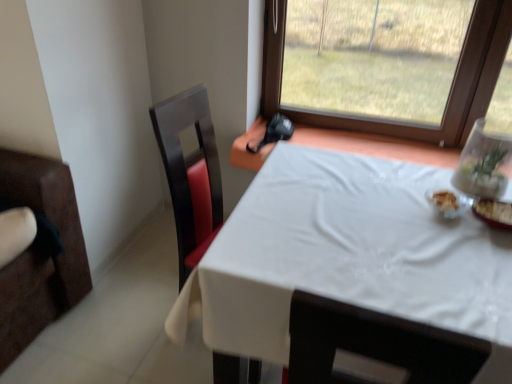
Locate an element on the screen. free space to the left of transparent glass vase at upper right is located at coordinates point(407,200).